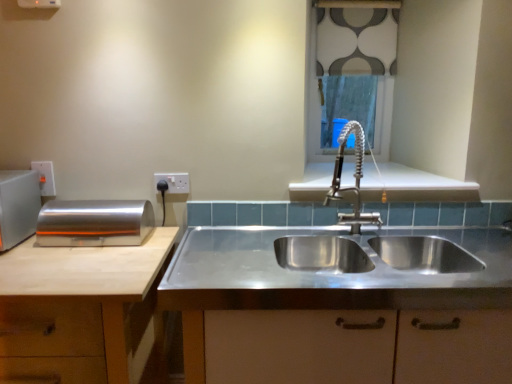
Find the location of a particular element. This screenshot has height=384, width=512. vacant area that is situated to the right of satin silver toaster at left, acting as the 2th appliance starting from the right is located at coordinates (42, 248).